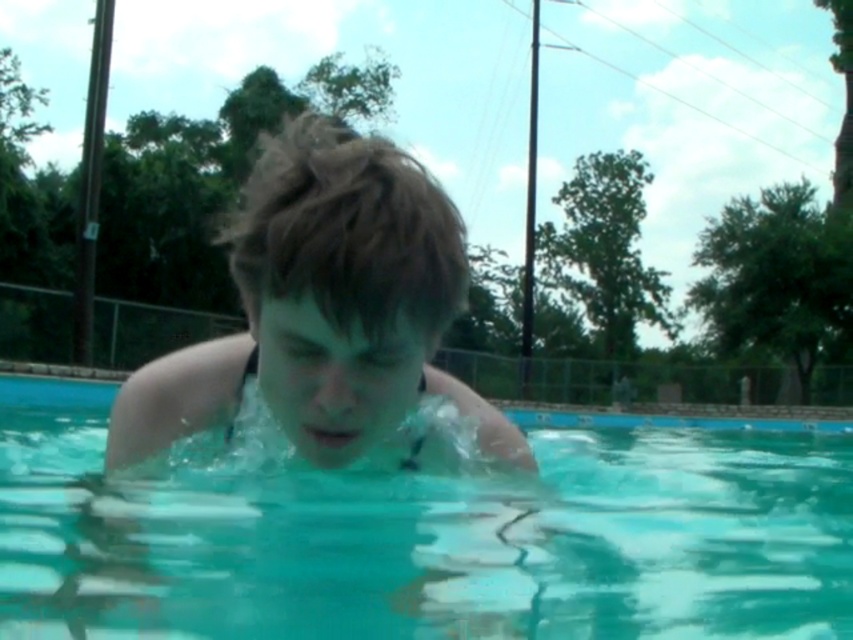
From the picture: Does clear blue water at center have a lesser height compared to smooth skin boy at center?

Incorrect, clear blue water at center's height does not fall short of smooth skin boy at center's.

How far apart are clear blue water at center and smooth skin boy at center?

clear blue water at center is 17.69 feet away from smooth skin boy at center.

This screenshot has width=853, height=640. What do you see at coordinates (428, 536) in the screenshot?
I see `clear blue water at center` at bounding box center [428, 536].

Identify the location of clear blue water at center. (428, 536).